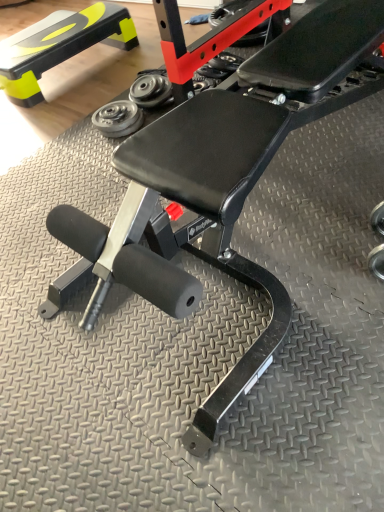
Question: In terms of size, does metallic silver weight at center, which appears as the 2th dumbbell when ordered from the bottom, appear bigger or smaller than matte black step at upper left?

Choices:
 (A) small
 (B) big

Answer: (A)

Question: From the image's perspective, relative to matte black step at upper left, is metallic silver weight at center, which appears as the 2th dumbbell when ordered from the bottom, above or below?

Choices:
 (A) above
 (B) below

Answer: (B)

Question: Which is farther from the metallic silver weight at center, acting as the 1th dumbbell starting from the top?

Choices:
 (A) silver metallic dumbbell at center, which appears as the second dumbbell when viewed from the top
 (B) matte black step at upper left

Answer: (B)

Question: Estimate the real-world distances between objects in this image. Which object is farther from the silver metallic dumbbell at center, which appears as the second dumbbell when viewed from the top?

Choices:
 (A) matte black step at upper left
 (B) metallic silver weight at center, acting as the 1th dumbbell starting from the top

Answer: (A)